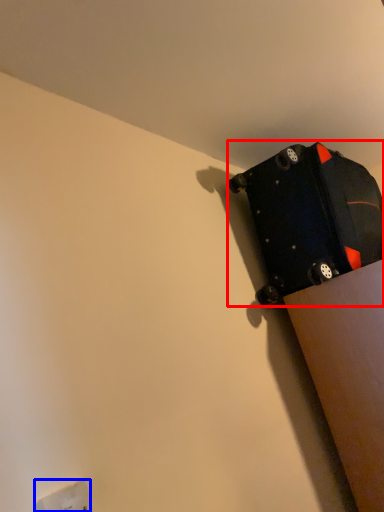
Question: Among these objects, which one is nearest to the camera, luggage and bags (highlighted by a red box) or electric outlet (highlighted by a blue box)?

Choices:
 (A) luggage and bags
 (B) electric outlet

Answer: (B)